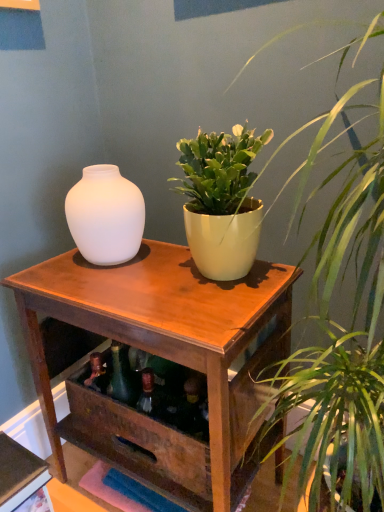
Question: Which direction should I rotate to look at matte yellow pot at upper center, placed as the 1th houseplant when sorted from bottom to top?

Choices:
 (A) left
 (B) right

Answer: (B)

Question: Is green matte plant pot at center, the 2th houseplant when ordered from bottom to top, completely or partially outside of matte yellow pot at upper center, marked as the 2th houseplant in a top-to-bottom arrangement?

Choices:
 (A) no
 (B) yes

Answer: (B)

Question: Can you confirm if green matte plant pot at center, marked as the 1th houseplant in a top-to-bottom arrangement, is bigger than matte yellow pot at upper center, marked as the 2th houseplant in a top-to-bottom arrangement?

Choices:
 (A) yes
 (B) no

Answer: (B)

Question: Does green matte plant pot at center, the 2th houseplant when ordered from bottom to top, have a lesser width compared to matte yellow pot at upper center, placed as the 1th houseplant when sorted from bottom to top?

Choices:
 (A) no
 (B) yes

Answer: (B)

Question: Is green matte plant pot at center, the 2th houseplant when ordered from bottom to top, further to the viewer compared to matte yellow pot at upper center, placed as the 1th houseplant when sorted from bottom to top?

Choices:
 (A) yes
 (B) no

Answer: (A)

Question: From a real-world perspective, is green matte plant pot at center, the 2th houseplant when ordered from bottom to top, on top of matte yellow pot at upper center, placed as the 1th houseplant when sorted from bottom to top?

Choices:
 (A) no
 (B) yes

Answer: (B)

Question: Is matte yellow pot at upper center, marked as the 2th houseplant in a top-to-bottom arrangement, completely or partially inside green matte plant pot at center, the 2th houseplant when ordered from bottom to top?

Choices:
 (A) no
 (B) yes

Answer: (A)

Question: From a real-world perspective, is matte white vase at left over green matte plant pot at center, marked as the 1th houseplant in a top-to-bottom arrangement?

Choices:
 (A) yes
 (B) no

Answer: (B)

Question: Is matte white vase at left at the left side of green matte plant pot at center, the 2th houseplant when ordered from bottom to top?

Choices:
 (A) no
 (B) yes

Answer: (B)

Question: Is matte white vase at left shorter than green matte plant pot at center, marked as the 1th houseplant in a top-to-bottom arrangement?

Choices:
 (A) yes
 (B) no

Answer: (A)

Question: Can you confirm if matte white vase at left is wider than green matte plant pot at center, the 2th houseplant when ordered from bottom to top?

Choices:
 (A) no
 (B) yes

Answer: (A)

Question: Is matte white vase at left not within green matte plant pot at center, the 2th houseplant when ordered from bottom to top?

Choices:
 (A) no
 (B) yes

Answer: (B)

Question: From the image's perspective, is matte white vase at left on top of green matte plant pot at center, the 2th houseplant when ordered from bottom to top?

Choices:
 (A) yes
 (B) no

Answer: (B)

Question: Is green matte plant pot at center, the 2th houseplant when ordered from bottom to top, with wooden table at center?

Choices:
 (A) no
 (B) yes

Answer: (A)